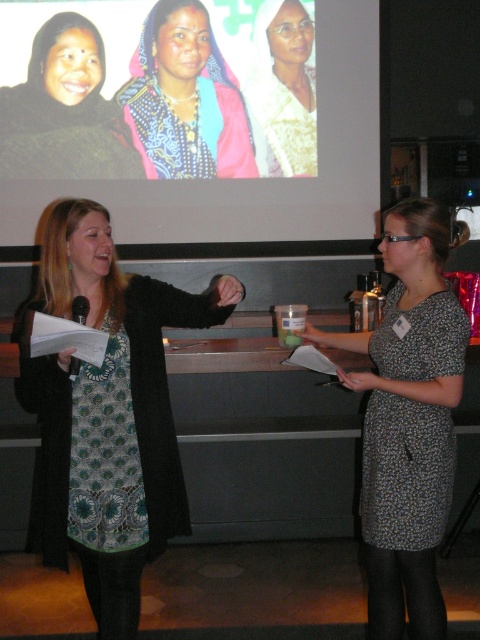
Is patterned fabric dress at center thinner than white textured scarf at upper center?

No, patterned fabric dress at center is not thinner than white textured scarf at upper center.

Who is more forward, (119, 314) or (300, 84)?

Point (119, 314)

Locate an element on the screen. This screenshot has height=640, width=480. patterned fabric dress at center is located at coordinates (108, 413).

Which is in front, point (80, 100) or point (294, 83)?

Point (80, 100) is in front.

Does matte black dress at upper left lie in front of white textured scarf at upper center?

Yes, matte black dress at upper left is closer to the viewer.

Find the location of `matte black dress at upper left`. matte black dress at upper left is located at coordinates (64, 109).

Find the location of a particular element. Image resolution: width=480 pixels, height=640 pixels. matte black dress at upper left is located at coordinates (64, 109).

What do you see at coordinates (408, 420) in the screenshot? The width and height of the screenshot is (480, 640). I see `printed fabric dress at center` at bounding box center [408, 420].

Can you confirm if printed fabric dress at center is wider than matte black dress at upper left?

No, printed fabric dress at center is not wider than matte black dress at upper left.

Identify the location of printed fabric dress at center. This screenshot has height=640, width=480. (408, 420).